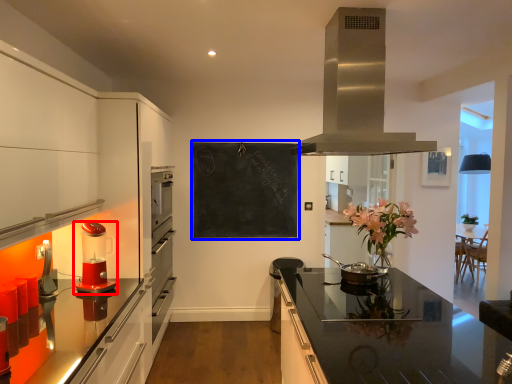
Question: Which object appears closest to the camera in this image, kitchen appliance (highlighted by a red box) or bulletin board (highlighted by a blue box)?

Choices:
 (A) kitchen appliance
 (B) bulletin board

Answer: (A)